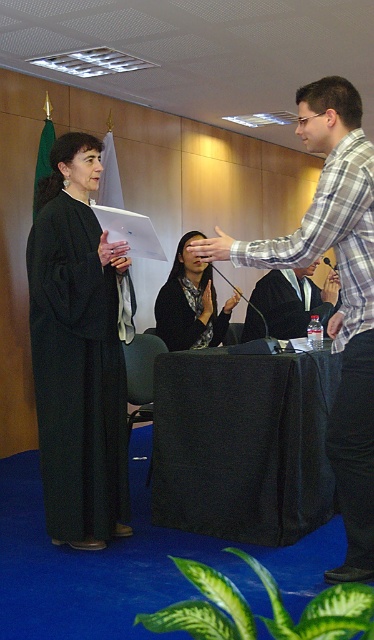
Which of these two, black fabric table at center or black matte robe at left, stands taller?

black matte robe at left is taller.

Is black fabric table at center thinner than black matte robe at left?

No.

The image size is (374, 640). What do you see at coordinates (243, 444) in the screenshot?
I see `black fabric table at center` at bounding box center [243, 444].

Locate an element on the screen. black fabric table at center is located at coordinates (243, 444).

Based on the photo, which is above, black fabric table at center or black matte robe at center?

black matte robe at center

From the picture: Does black fabric table at center come in front of black matte robe at center?

Yes, black fabric table at center is in front of black matte robe at center.

Find the location of a particular element. Image resolution: width=374 pixels, height=640 pixels. black fabric table at center is located at coordinates (243, 444).

Can you confirm if black robe at center is bigger than matte black jacket at center?

Yes.

Is black robe at center to the left of matte black jacket at center from the viewer's perspective?

No, black robe at center is not to the left of matte black jacket at center.

Does point (335, 112) come farther from viewer compared to point (228, 320)?

No, it is in front of (228, 320).

Locate an element on the screen. black robe at center is located at coordinates (341, 292).